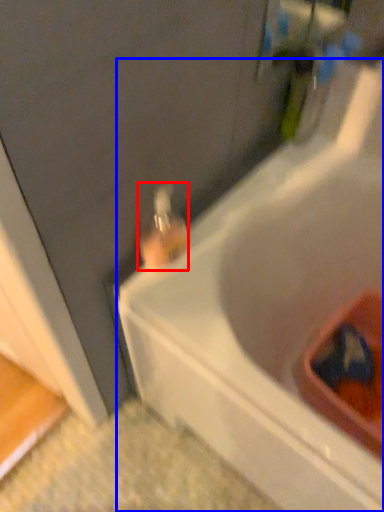
Question: Which object appears closest to the camera in this image, bottle (highlighted by a red box) or bathtub (highlighted by a blue box)?

Choices:
 (A) bottle
 (B) bathtub

Answer: (B)